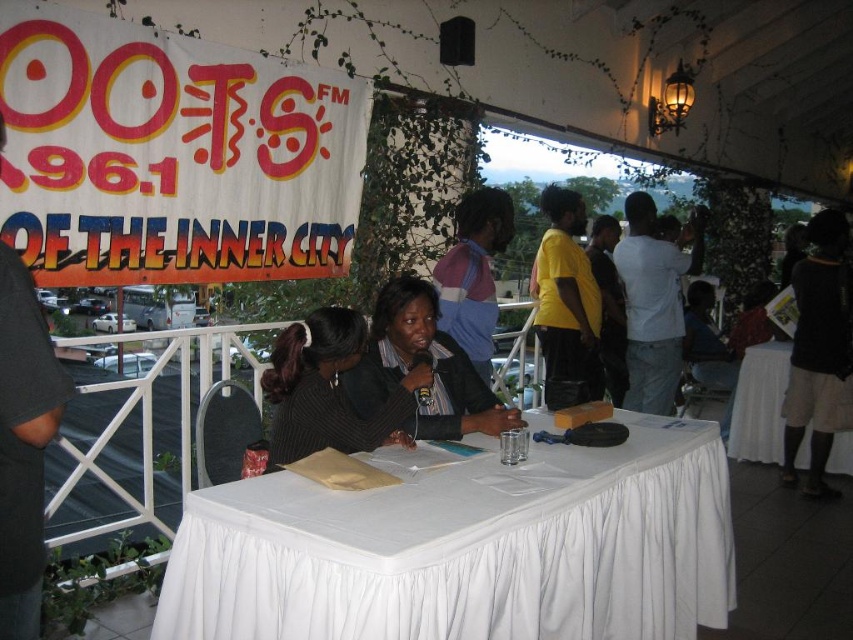
You are a photographer taking a photo of the scene. You need to ensure that both the dark gray sweater at center and the matte black jacket at center are visible in the frame. Based on their heights, which one might you need to adjust your camera angle to better capture?

The dark gray sweater at center has a lesser height compared to the matte black jacket at center, so you might need to lower your camera angle slightly to ensure the sweater is fully visible without being obscured by the taller jacket.

You are a photographer positioned to the right of the table. You want to capture a shot that includes both the dark gray sweater at center and the matte black jacket at center. Which object should you adjust your camera angle to include first if you need to pan from left to right?

The dark gray sweater at center is to the left of the matte black jacket at center, so you should first pan to include the dark gray sweater at center before moving the camera to the right to include the matte black jacket at center.